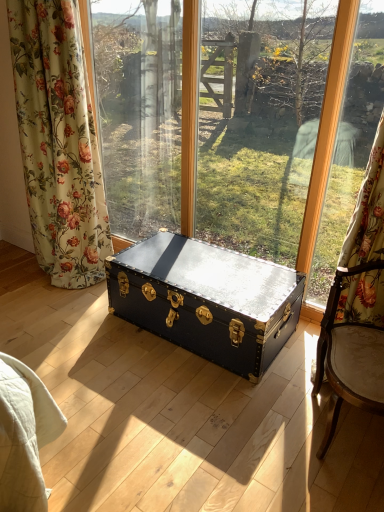
At what (x,y) coordinates should I click in order to perform the action: click on vacant area in front of shiny black trunk at center. Please return your answer as a coordinate pair (x, y). This screenshot has width=384, height=512. Looking at the image, I should click on (195, 419).